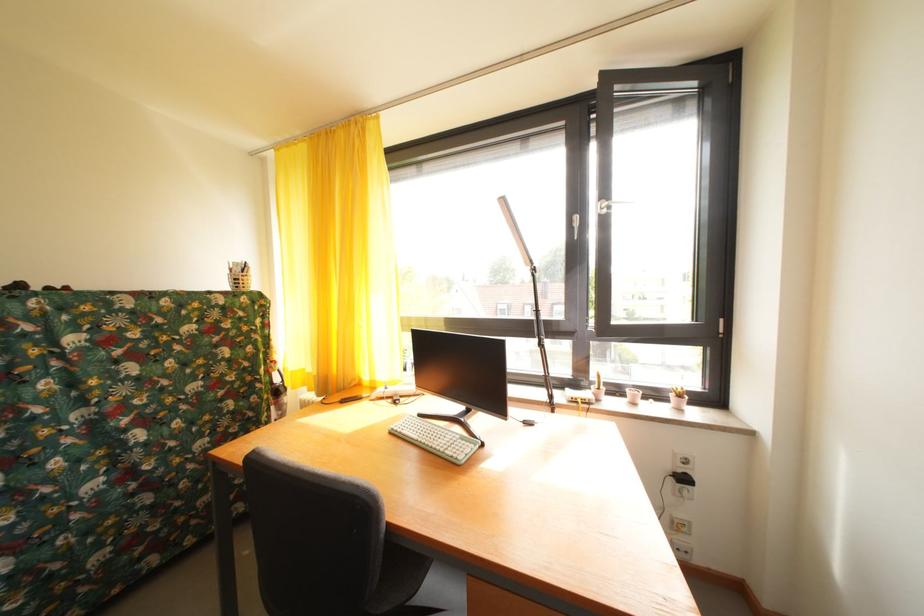
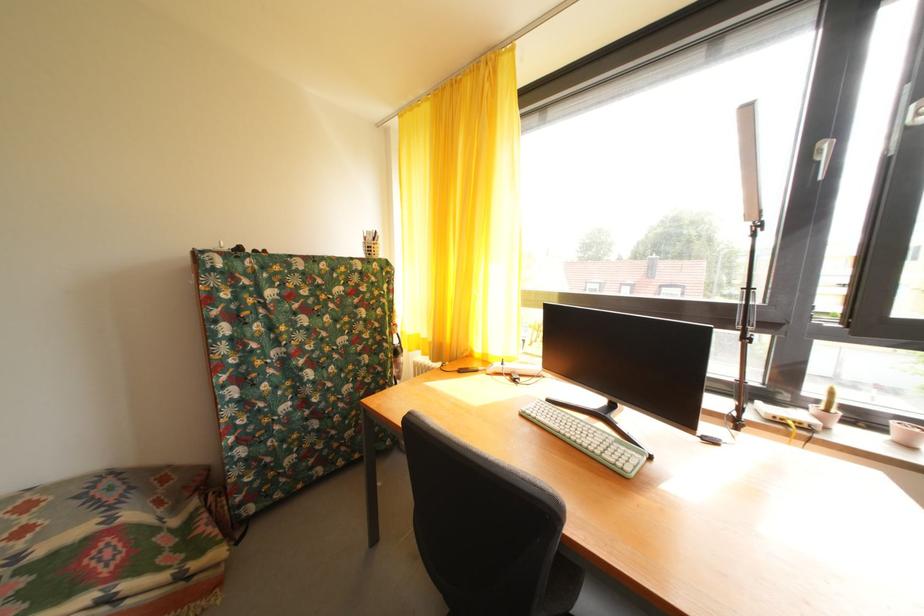
Where in the second image is the point corresponding to the point at 608,394 from the first image?

(836, 416)